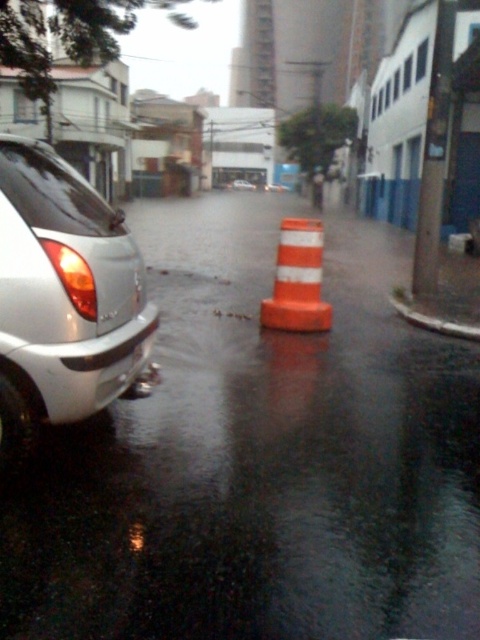
Question: Among these objects, which one is nearest to the camera?

Choices:
 (A) glossy orange cone at center
 (B) matte black car at center
 (C) satin silver car at left
 (D) orange reflective cone at center

Answer: (A)

Question: Which object is the farthest from the matte black car at center?

Choices:
 (A) orange reflective cone at center
 (B) satin silver car at left
 (C) glossy orange cone at center

Answer: (B)

Question: Observing the image, what is the correct spatial positioning of glossy orange cone at center in reference to orange reflective cone at center?

Choices:
 (A) right
 (B) left

Answer: (A)

Question: Which point appears farthest from the camera in this image?

Choices:
 (A) (307, 324)
 (B) (236, 182)

Answer: (B)

Question: Can you confirm if satin silver car at left is wider than orange reflective cone at center?

Choices:
 (A) no
 (B) yes

Answer: (A)

Question: Does satin silver car at left have a lesser width compared to orange reflective cone at center?

Choices:
 (A) no
 (B) yes

Answer: (B)